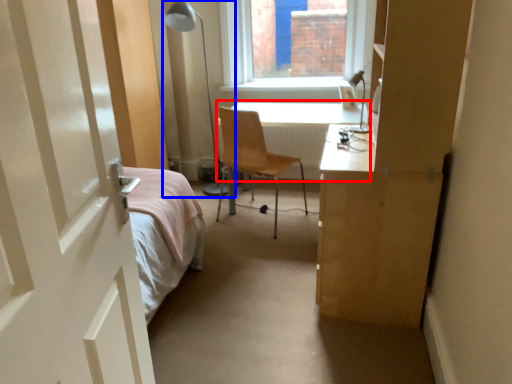
Question: Which object appears closest to the camera in this image, table (highlighted by a red box) or table lamp (highlighted by a blue box)?

Choices:
 (A) table
 (B) table lamp

Answer: (B)